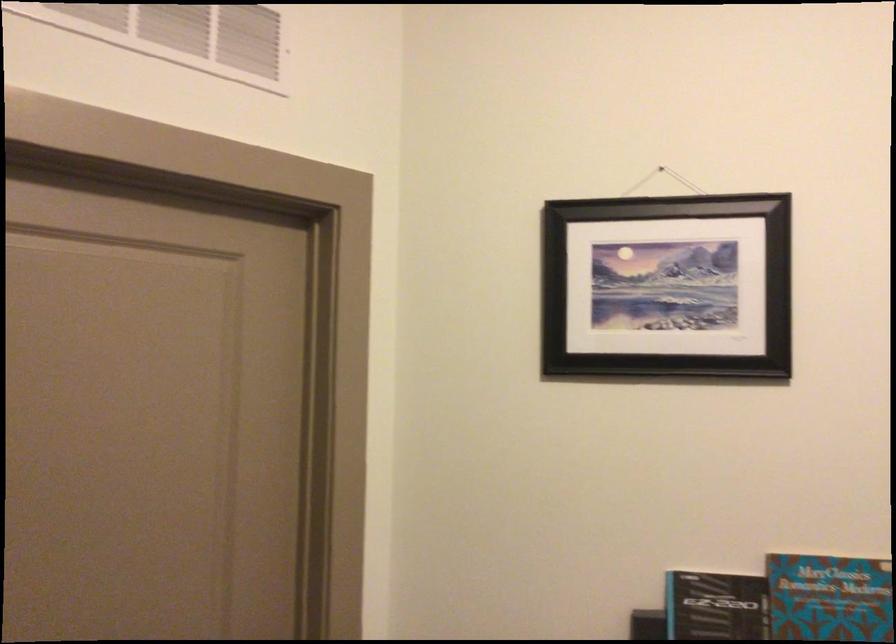
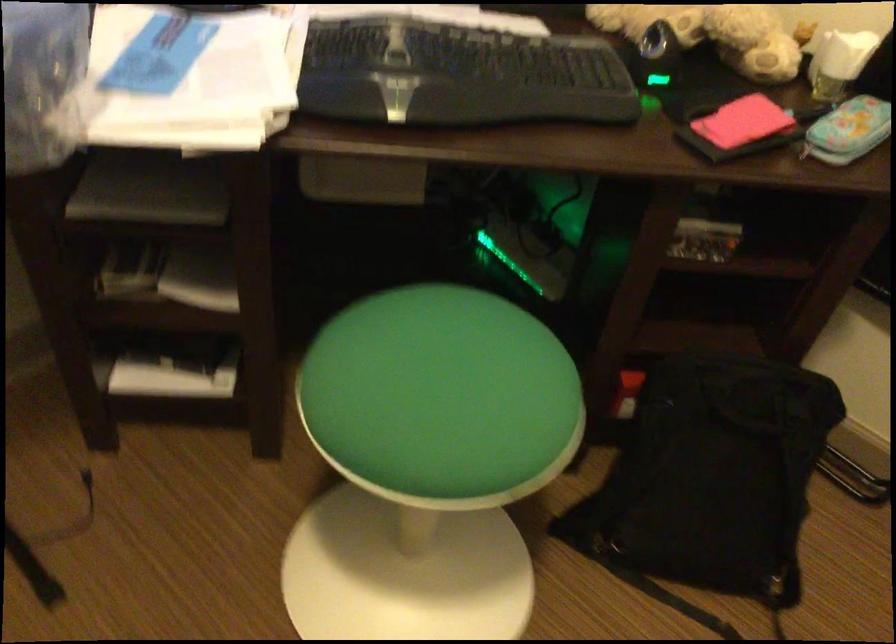
First-person continuous shooting, in which direction is the camera rotating?

The camera rotated toward right-down.